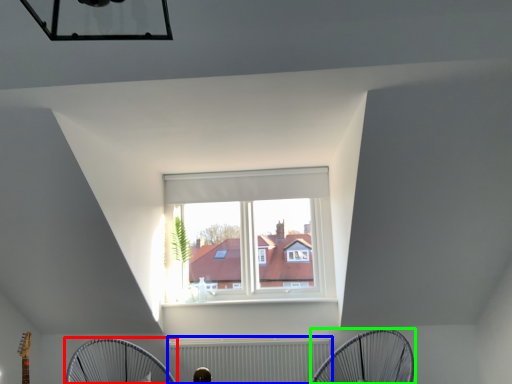
Question: Which object is the farthest from mechanical fan (highlighted by a red box)? Choose among these: radiator (highlighted by a blue box) or mechanical fan (highlighted by a green box).

Choices:
 (A) radiator
 (B) mechanical fan

Answer: (B)